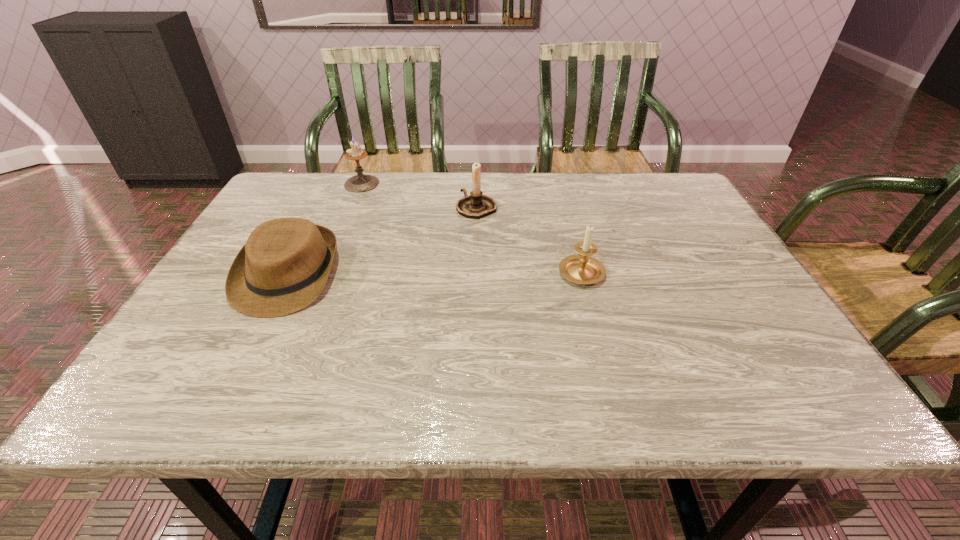
Locate an element on the screen. The image size is (960, 540). the leftmost candle holder is located at coordinates (359, 183).

In order to click on the farthest object in this screenshot , I will do tap(359, 183).

In order to click on the second farthest candle holder in this screenshot , I will do `click(477, 205)`.

You are a GUI agent. You are given a task and a screenshot of the screen. Output one action in this format:
    pyautogui.click(x=<x>, y=<y>)
    Task: Click on the third nearest object
    The image size is (960, 540).
    Given the screenshot: What is the action you would take?
    pyautogui.click(x=477, y=205)

At what (x,y) coordinates should I click in order to perform the action: click on the rightmost object. Please return your answer as a coordinate pair (x, y). The height and width of the screenshot is (540, 960). Looking at the image, I should click on (582, 269).

Locate an element on the screen. Image resolution: width=960 pixels, height=540 pixels. the nearest candle holder is located at coordinates (582, 269).

In order to click on fedora in this screenshot , I will do `click(283, 267)`.

You are a GUI agent. You are given a task and a screenshot of the screen. Output one action in this format:
    pyautogui.click(x=<x>, y=<y>)
    Task: Click on the vacant space located 0.330m on the front of the farthest candle holder
    
    Given the screenshot: What is the action you would take?
    pyautogui.click(x=329, y=264)

In order to click on vacant space situated on the right of the third nearest object in this screenshot , I will do `click(633, 207)`.

The height and width of the screenshot is (540, 960). Identify the location of free location located with a handle on the side of the rightmost object. (569, 228).